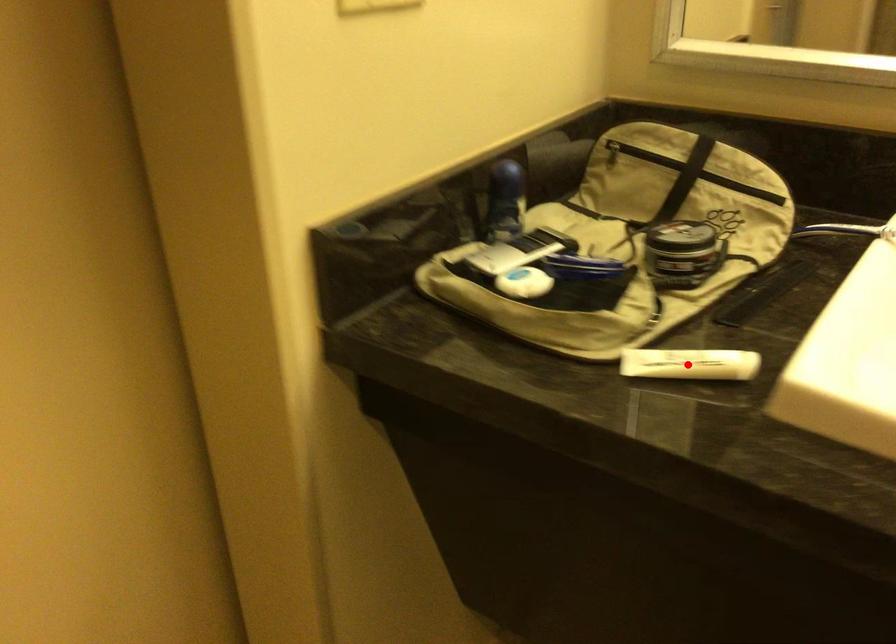
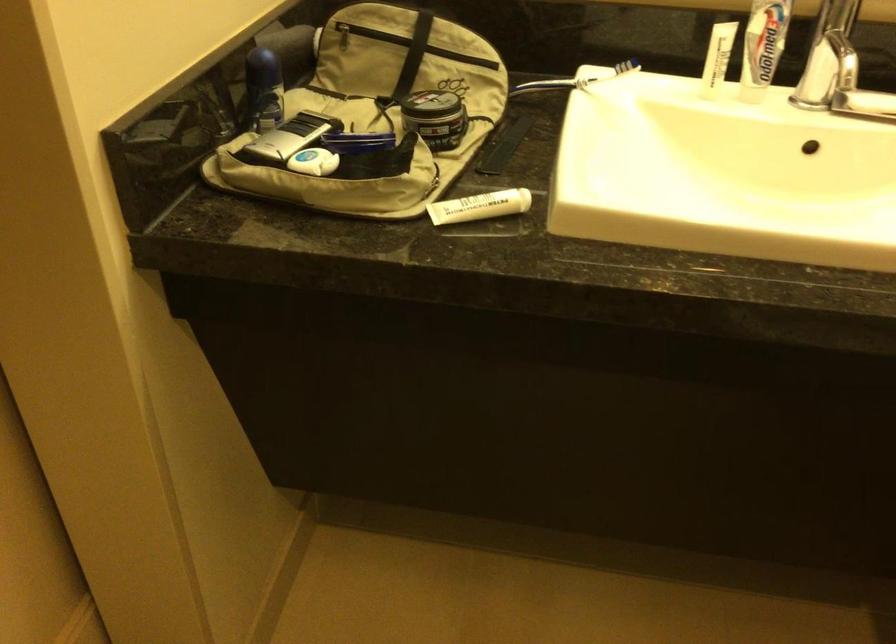
The point at the highlighted location is marked in the first image. Where is the corresponding point in the second image?

(479, 205)